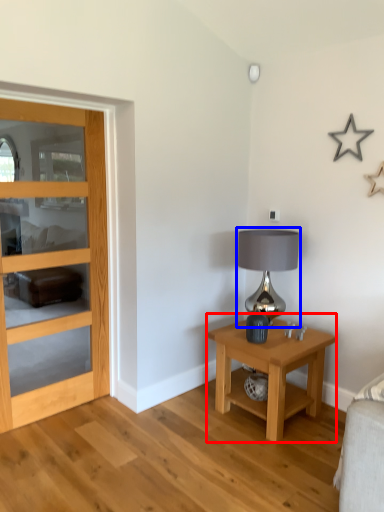
Question: Which object appears farthest to the camera in this image, nightstand (highlighted by a red box) or table lamp (highlighted by a blue box)?

Choices:
 (A) nightstand
 (B) table lamp

Answer: (B)